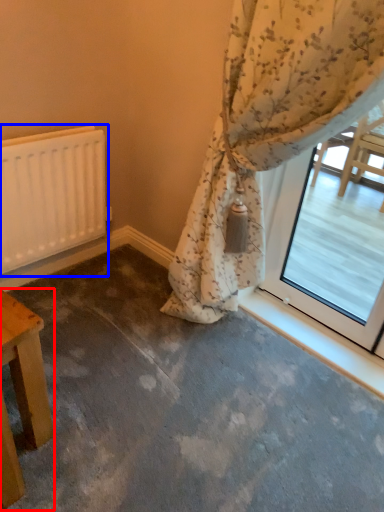
Question: Which object appears closest to the camera in this image, table (highlighted by a red box) or radiator (highlighted by a blue box)?

Choices:
 (A) table
 (B) radiator

Answer: (A)